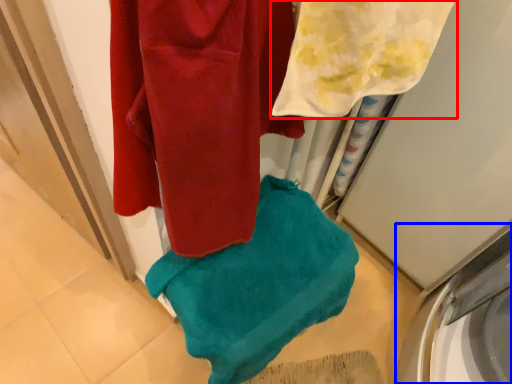
Question: Among these objects, which one is nearest to the camera, towel (highlighted by a red box) or washing machine (highlighted by a blue box)?

Choices:
 (A) towel
 (B) washing machine

Answer: (A)